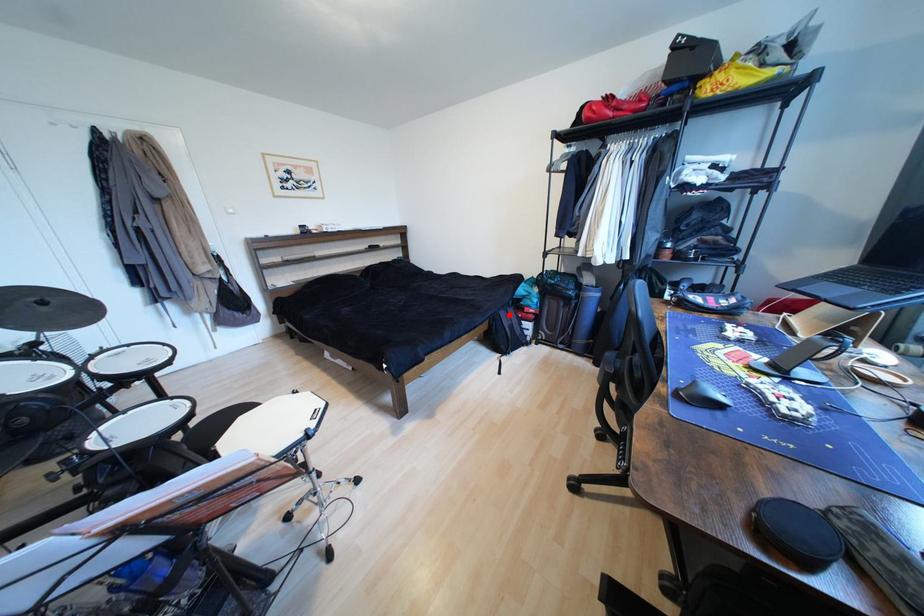
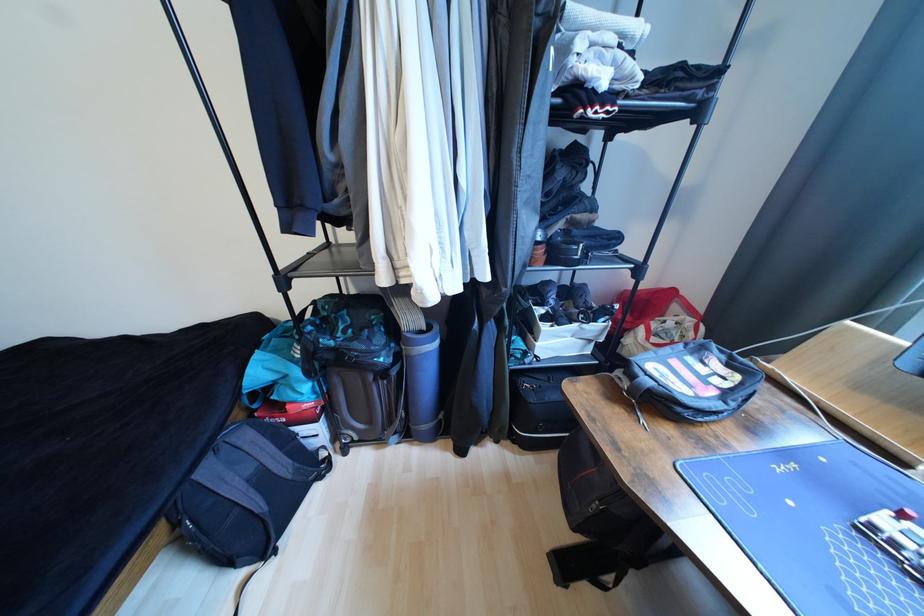
Find the pixel in the second image that matches the highlighted location in the first image.

(215, 472)